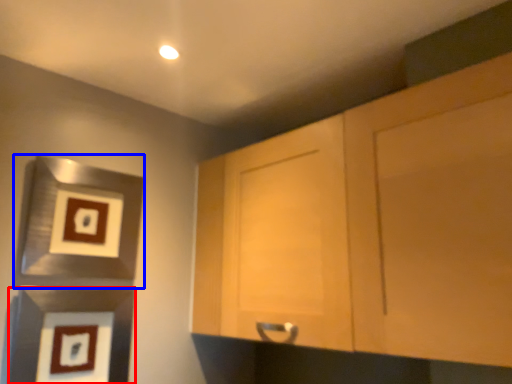
Question: Which object is further to the camera taking this photo, picture frame (highlighted by a red box) or picture frame (highlighted by a blue box)?

Choices:
 (A) picture frame
 (B) picture frame

Answer: (B)